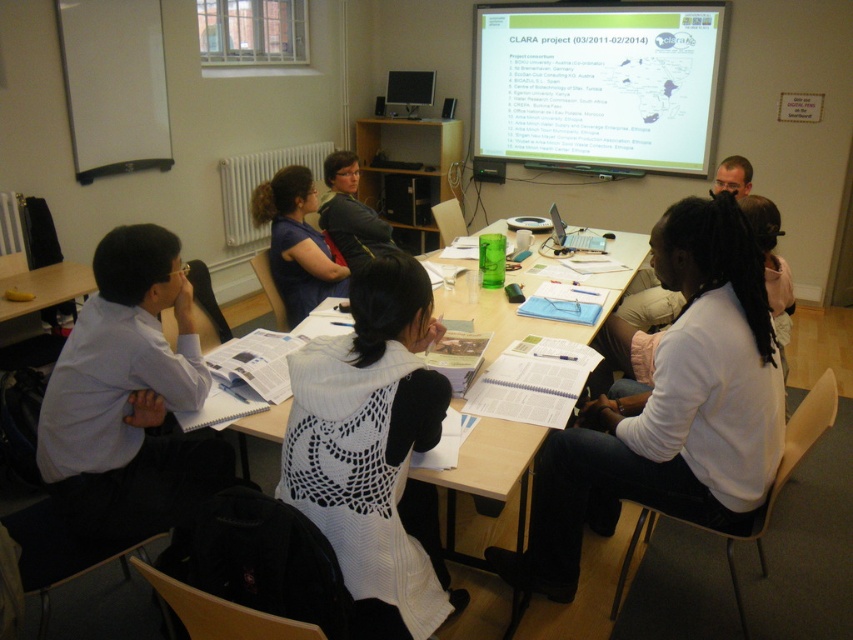
Locate an element on the screen. The height and width of the screenshot is (640, 853). white knit sweater at center is located at coordinates click(669, 410).

Between point (686, 216) and point (292, 292), which one is positioned in front?

Point (686, 216) is more forward.

The height and width of the screenshot is (640, 853). Identify the location of white knit sweater at center. (669, 410).

Does white glossy projector screen at upper center have a greater width compared to wooden table at center?

Yes, white glossy projector screen at upper center is wider than wooden table at center.

Is point (624, 19) positioned in front of point (592, 276)?

No, (624, 19) is behind (592, 276).

Image resolution: width=853 pixels, height=640 pixels. I want to click on white glossy projector screen at upper center, so click(x=598, y=84).

Where is `white glossy projector screen at upper center`? The height and width of the screenshot is (640, 853). white glossy projector screen at upper center is located at coordinates (598, 84).

Can you confirm if white knitted vest at center is positioned above white shirt at left?

Incorrect, white knitted vest at center is not positioned above white shirt at left.

Is point (438, 419) positioned after point (42, 438)?

No, it is not.

The width and height of the screenshot is (853, 640). In order to click on white knitted vest at center in this screenshot , I will do `click(374, 451)`.

Find the location of a particular element. white knitted vest at center is located at coordinates (374, 451).